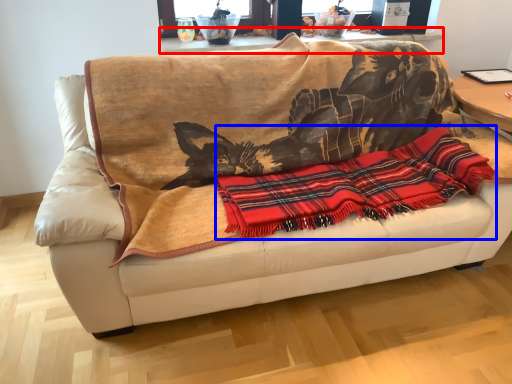
Question: Which point is further to the camera, table (highlighted by a red box) or cloth (highlighted by a blue box)?

Choices:
 (A) table
 (B) cloth

Answer: (A)